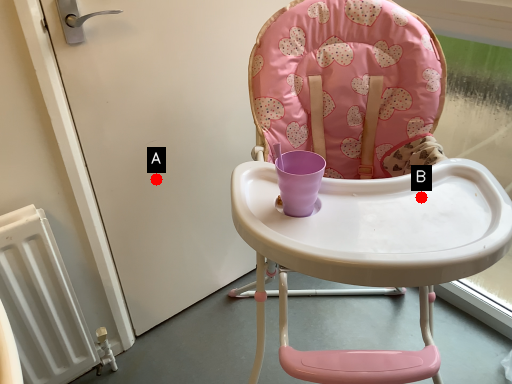
Question: Two points are circled on the image, labeled by A and B beside each circle. Which point is closer to the camera taking this photo?

Choices:
 (A) A is closer
 (B) B is closer

Answer: (B)